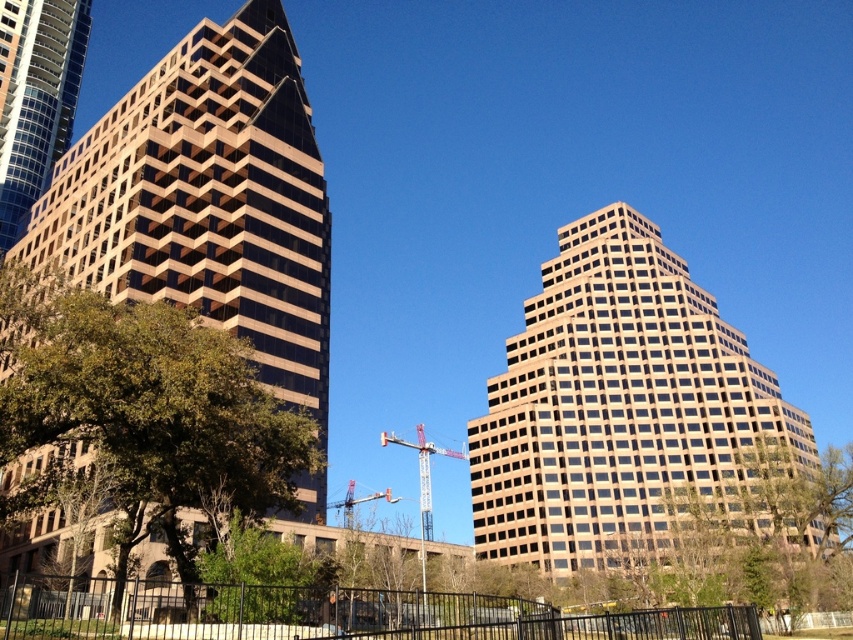
Question: Which point is farther from the camera taking this photo?

Choices:
 (A) (42, 10)
 (B) (424, 497)
 (C) (589, 412)

Answer: (B)

Question: In this image, where is matte tan building at center located relative to metallic silver crane at center?

Choices:
 (A) above
 (B) below

Answer: (A)

Question: Which point is farther to the camera?

Choices:
 (A) (65, 134)
 (B) (364, 497)
 (C) (128, 124)

Answer: (B)

Question: Which point appears farthest from the camera in this image?

Choices:
 (A) (241, 320)
 (B) (543, 328)
 (C) (421, 500)
 (D) (62, 8)

Answer: (C)

Question: In this image, where is beige glass skyscraper at left located relative to metallic silver crane at center?

Choices:
 (A) left
 (B) right

Answer: (A)

Question: Does beige glass building at center appear over matte tan building at center?

Choices:
 (A) no
 (B) yes

Answer: (A)